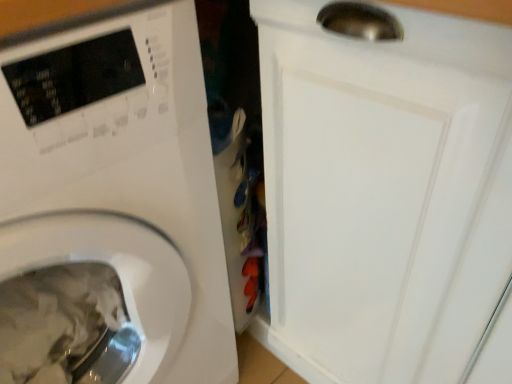
This screenshot has width=512, height=384. What are the coordinates of `white glossy washing machine at left` in the screenshot? It's located at (121, 177).

This screenshot has width=512, height=384. Describe the element at coordinates (121, 177) in the screenshot. I see `white glossy washing machine at left` at that location.

Locate an element on the screen. The height and width of the screenshot is (384, 512). white glossy washing machine at left is located at coordinates (121, 177).